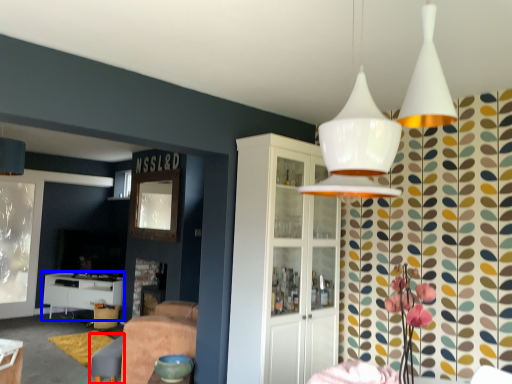
Question: Which of the following is the farthest to the observer, swivel chair (highlighted by a red box) or table (highlighted by a blue box)?

Choices:
 (A) swivel chair
 (B) table

Answer: (B)